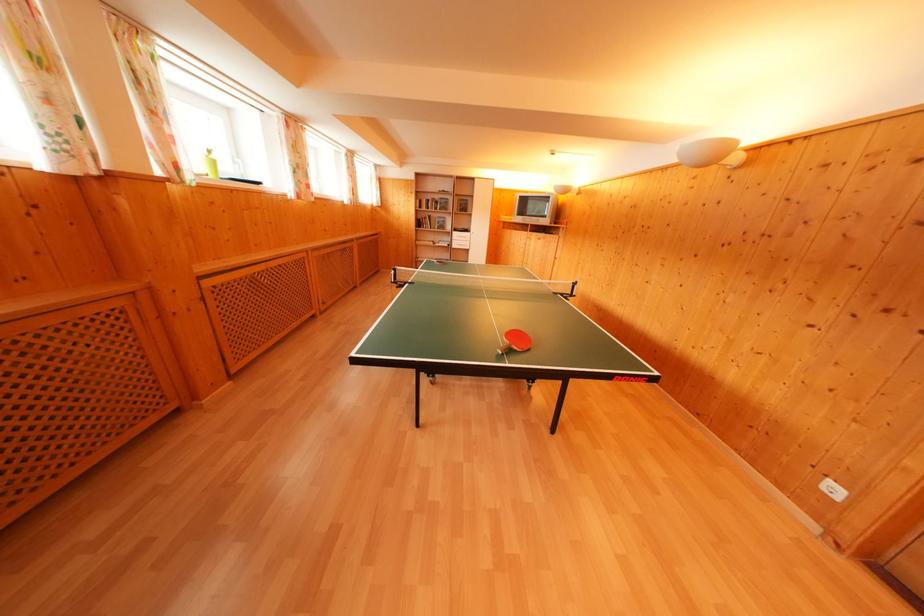
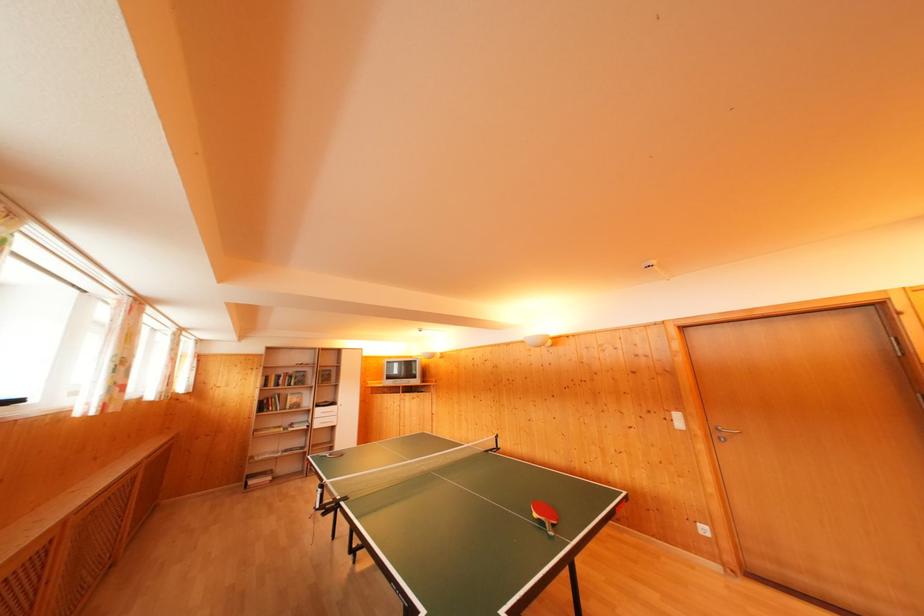
Find the pixel in the second image that matches (839,495) in the first image.

(709, 535)